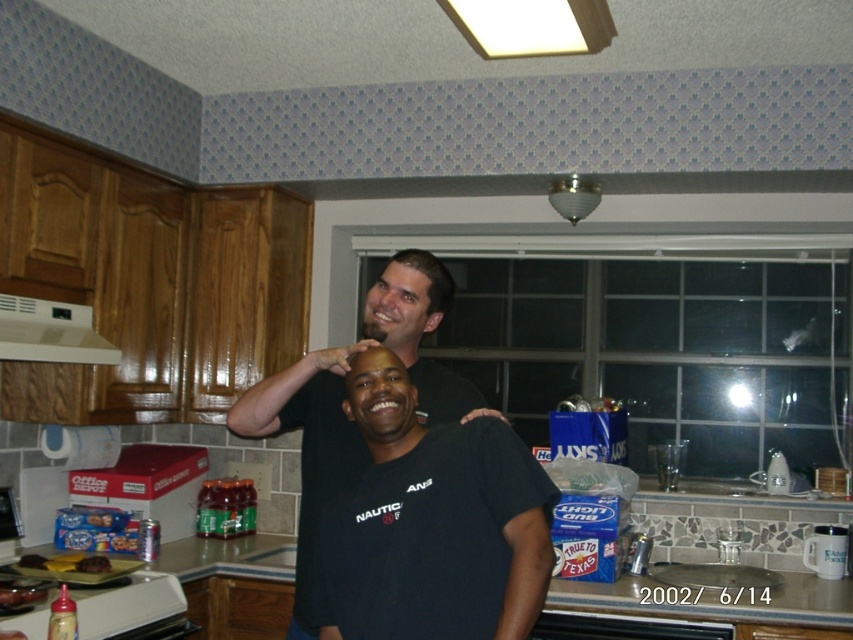
You are a photographer setting up for a group photo in the kitchen. The black cotton shirt at center and the matte black head at upper center are in your frame. You need to ensure there is at least 20 inches between them for proper composition. Based on the scene description, is the current distance sufficient?

The black cotton shirt at center is 17.83 inches away from the matte black head at upper center. Since 17.83 inches is less than the required 20 inches, the current distance is insufficient for the desired composition.

You are a photographer setting up a shot in the kitchen. You notice the black cotton shirt at center and the matte black head at upper center. Which object is positioned lower in the frame?

The black cotton shirt at center is located below the matte black head at upper center, so the black cotton shirt at center is positioned lower in the frame.

Please describe the location of the matte black head at upper center in the kitchen scene using coordinates. The scene has a coordinate system where the bottom left corner is the origin point. The x and y axes are measured in fractions of the image width and height respectively. For example, the center of the image would be at coordinates approximately 0.5, 0.5. Please provide the coordinates as a pair of numbers separated by a comma, enclosed in parentheses. The answer should be concise and only include a

The coordinates of the matte black head at upper center are given as point (405, 301). Based on the coordinate system described, this places the matte black head at upper center near the center of the image, slightly to the left and just below the midpoint vertically.